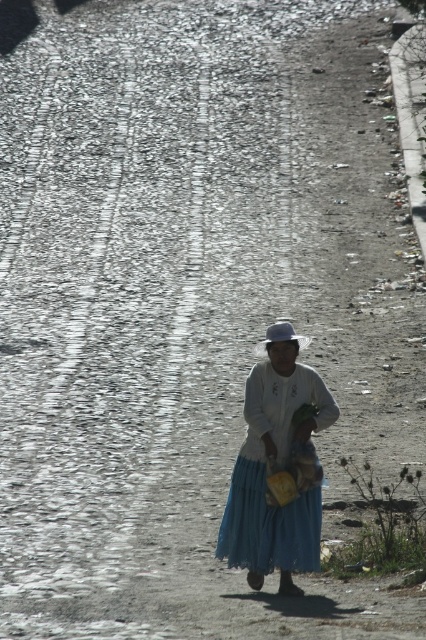
You are a fashion designer observing a person wearing a white cotton dress at center and a natural straw hat at center. Which item of clothing appears smaller in size?

The white cotton dress at center has a smaller size compared to the natural straw hat at center, so the white cotton dress at center appears smaller.

You are a photographer trying to capture the person in the center. You want to know the position of the white cotton dress at center relative to the natural straw hat at center to frame your shot. Which object is on the left?

The white cotton dress at center is positioned on the left side of natural straw hat at center.

You are a photographer trying to capture the person in the center of the cobblestone street. You want to ensure that both the white cotton dress at center and the natural straw hat at center are clearly visible in the photo. Based on their positions, which object should you focus on first to ensure both are in focus?

The white cotton dress at center is below the natural straw hat at center. Since the dress is lower, focusing on the hat first would allow the dress to be in focus as well due to its position below.